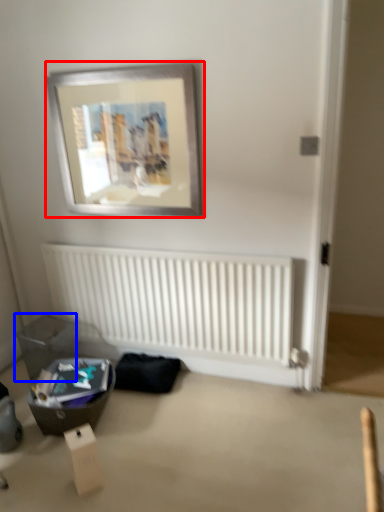
Question: Which point is closer to the camera, picture frame (highlighted by a red box) or storage box (highlighted by a blue box)?

Choices:
 (A) picture frame
 (B) storage box

Answer: (A)